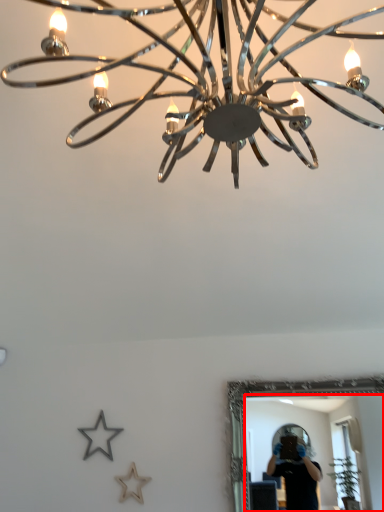
Question: In this image, where is mirror (annotated by the red box) located relative to lamp?

Choices:
 (A) right
 (B) left

Answer: (A)